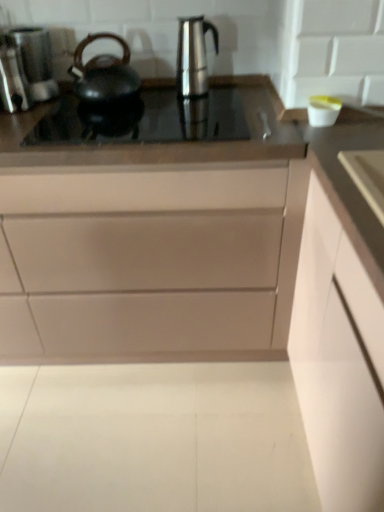
Find the location of a particular element. This screenshot has width=384, height=512. free spot in front of stainless steel coffee pot at center is located at coordinates (216, 113).